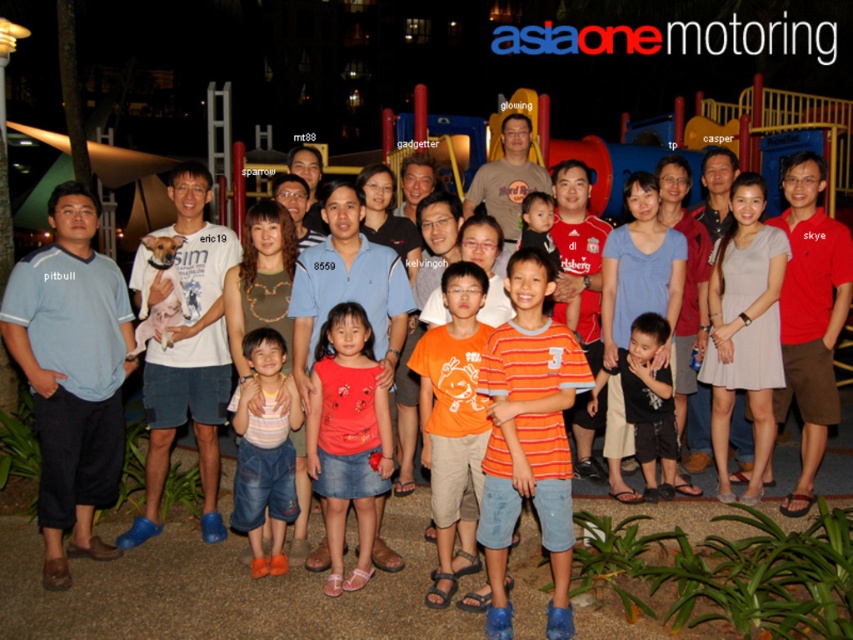
How far apart are matte red shirt at center and orange cotton shirt at center?

25.81 inches

Image resolution: width=853 pixels, height=640 pixels. Describe the element at coordinates (347, 436) in the screenshot. I see `matte red shirt at center` at that location.

This screenshot has width=853, height=640. Find the location of `matte red shirt at center`. matte red shirt at center is located at coordinates (347, 436).

Find the location of a particular element. striped cotton shirt at center is located at coordinates (264, 451).

Can you confirm if striped cotton shirt at center is taller than black cotton shirt at center?

Yes, striped cotton shirt at center is taller than black cotton shirt at center.

Between point (257, 348) and point (619, 348), which one is positioned in front?

Point (257, 348) is more forward.

At what (x,y) coordinates should I click in order to perform the action: click on striped cotton shirt at center. Please return your answer as a coordinate pair (x, y). This screenshot has width=853, height=640. Looking at the image, I should click on (264, 451).

Does matte red shirt at center have a lesser width compared to striped cotton shirt at center?

Incorrect, matte red shirt at center's width is not less than striped cotton shirt at center's.

Who is taller, matte red shirt at center or striped cotton shirt at center?

matte red shirt at center

Image resolution: width=853 pixels, height=640 pixels. In order to click on matte red shirt at center in this screenshot , I will do click(x=347, y=436).

The image size is (853, 640). In order to click on matte red shirt at center in this screenshot , I will do `click(347, 436)`.